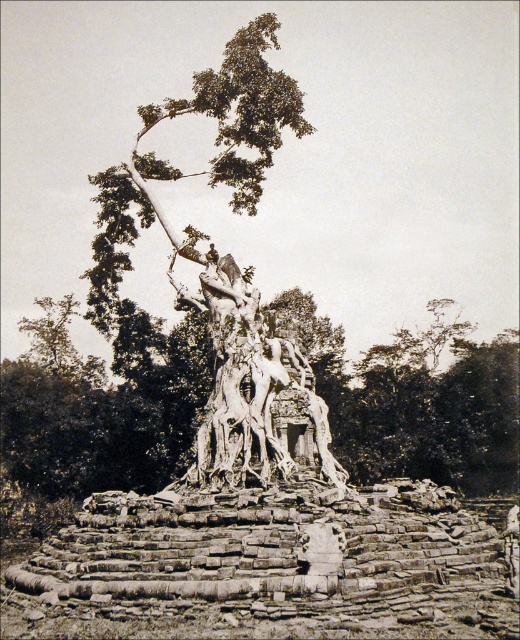
Consider the image. Can you confirm if rough bark tree trunk at center is smaller than white stone sculpture at center?

No.

What do you see at coordinates (108, 412) in the screenshot?
I see `rough bark tree trunk at center` at bounding box center [108, 412].

Is point (421, 419) positioned after point (206, 474)?

Yes, point (421, 419) is farther from viewer.

This screenshot has height=640, width=520. In order to click on rough bark tree trunk at center in this screenshot , I will do `click(108, 412)`.

Can you confirm if rough bark tree trunk at center is bigger than stone statue at center?

Yes.

Does point (446, 432) lie behind point (303, 369)?

Yes, point (446, 432) is behind point (303, 369).

Where is `rough bark tree trunk at center`? The height and width of the screenshot is (640, 520). rough bark tree trunk at center is located at coordinates (108, 412).

Consider the image. Between stone statue at center and white stone sculpture at center, which one has less height?

With less height is white stone sculpture at center.

The width and height of the screenshot is (520, 640). Find the location of `stone statue at center`. stone statue at center is located at coordinates (222, 264).

You are a GUI agent. You are given a task and a screenshot of the screen. Output one action in this format:
    pyautogui.click(x=<x>, y=<y>)
    Task: Click on the stone statue at center
    This screenshot has width=520, height=640.
    Given the screenshot: What is the action you would take?
    pyautogui.click(x=222, y=264)